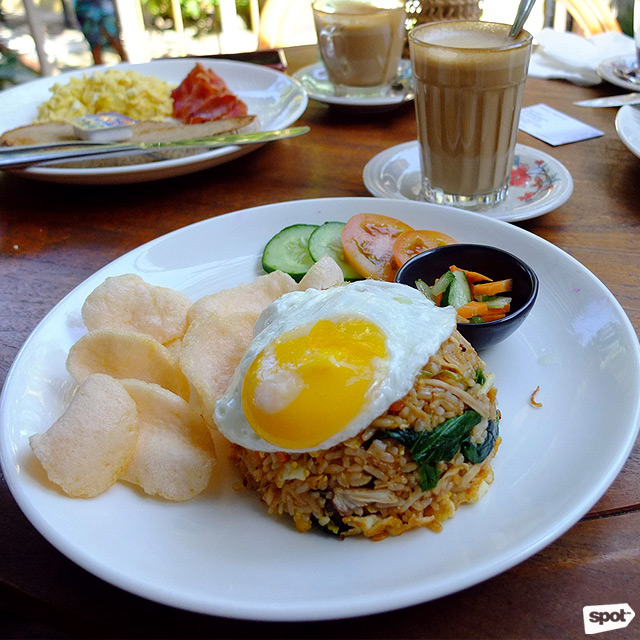
Locate an element on the screen. This screenshot has height=640, width=640. glass cups is located at coordinates (457, 112), (466, 74), (493, 128), (348, 29), (349, 50), (370, 36).